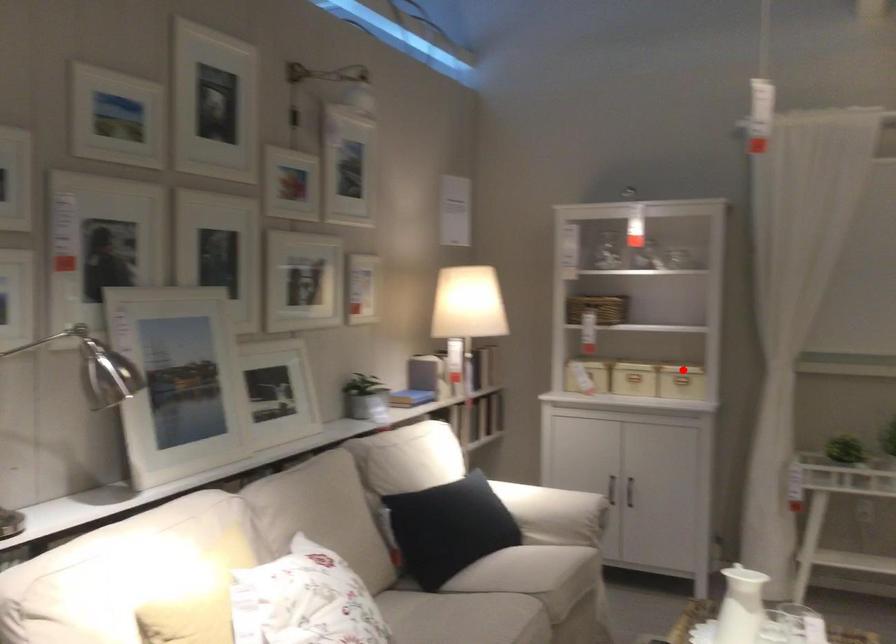
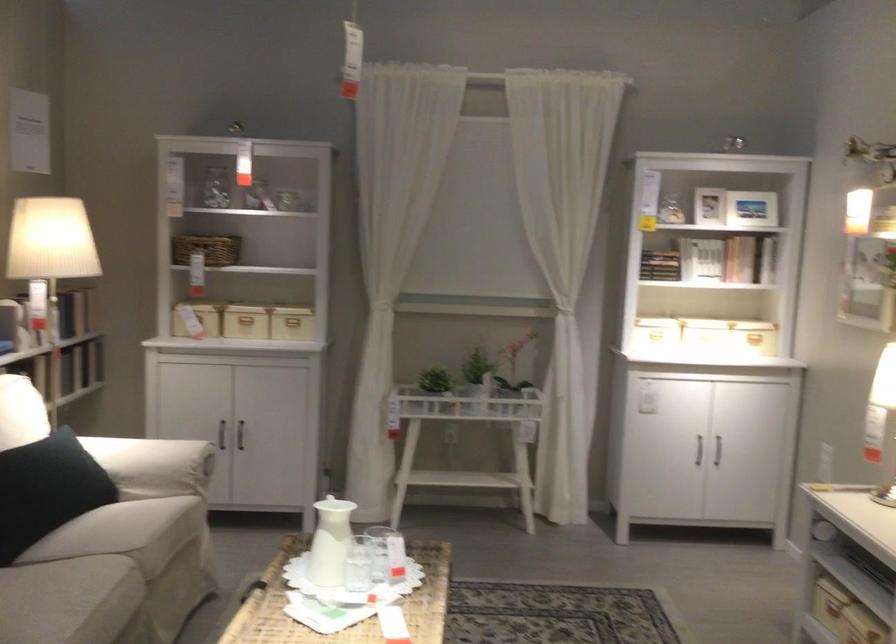
Locate, in the second image, the point that corresponds to the highlighted location in the first image.

(291, 321)